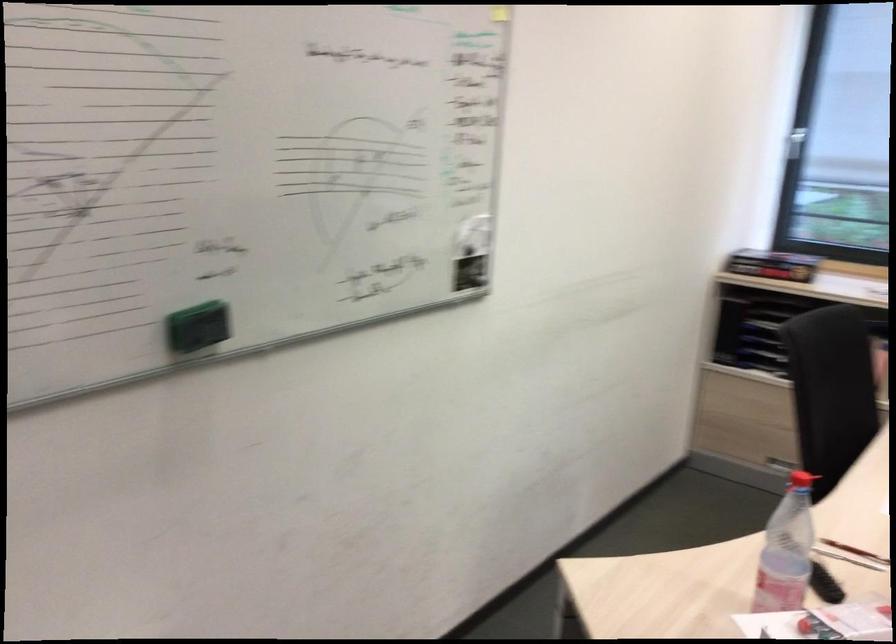
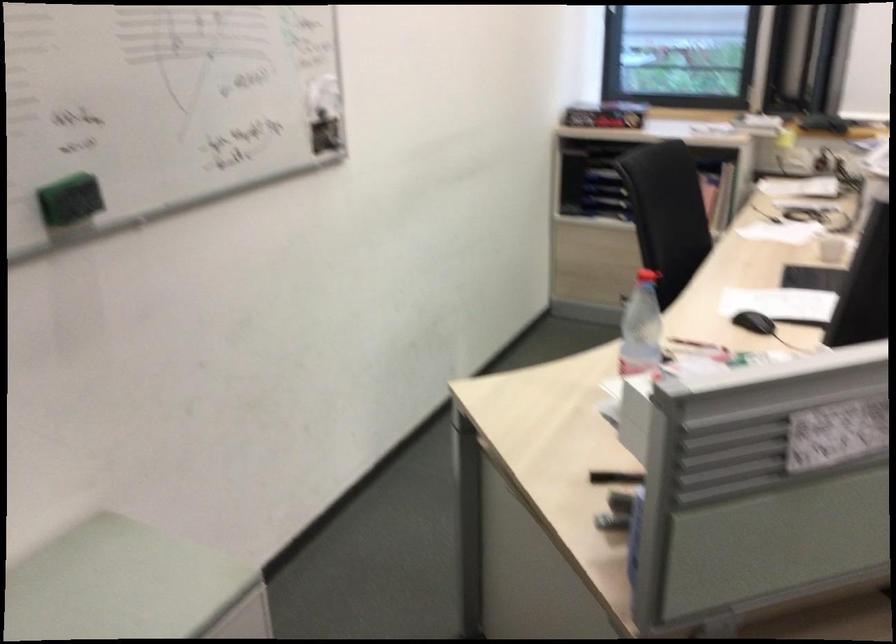
Find the pixel in the second image that matches (x=202, y=319) in the first image.

(70, 200)